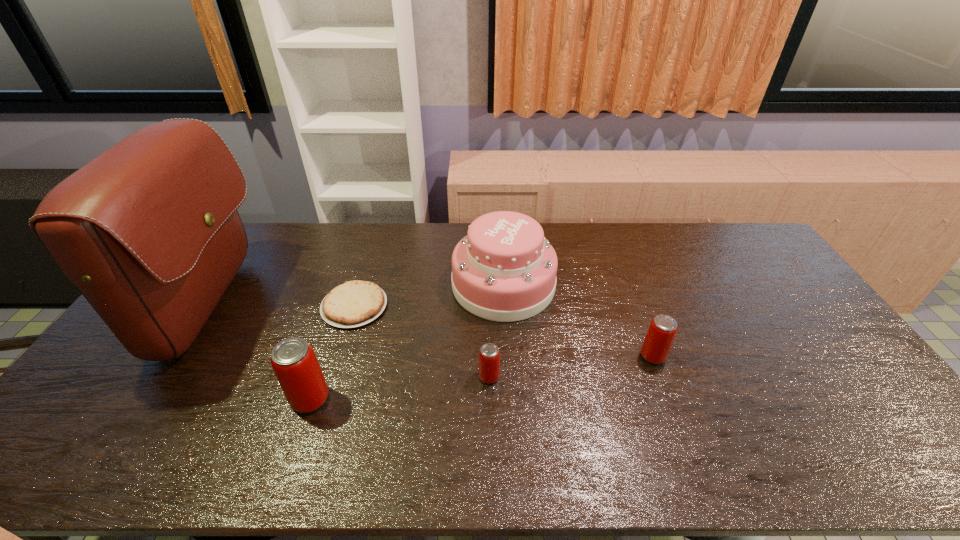
Identify the location of free spot that satisfies the following two spatial constraints: 1. on the back side of the second shortest beer can; 2. on the left side of the fourth shortest object. The width and height of the screenshot is (960, 540). (324, 356).

You are a GUI agent. You are given a task and a screenshot of the screen. Output one action in this format:
    pyautogui.click(x=<x>, y=<y>)
    Task: Click on the vacant space that satisfies the following two spatial constraints: 1. on the open flap of the second tallest beer can; 2. on the left side of the leftmost object
    The height and width of the screenshot is (540, 960).
    Given the screenshot: What is the action you would take?
    pyautogui.click(x=180, y=356)

Find the location of a particular element. free spot that satisfies the following two spatial constraints: 1. on the back side of the tallest beer can; 2. on the open flap of the tallest object is located at coordinates (341, 307).

Image resolution: width=960 pixels, height=540 pixels. I want to click on vacant space that satisfies the following two spatial constraints: 1. on the back side of the second beer can from right to left; 2. on the left side of the second tallest beer can, so click(489, 356).

The width and height of the screenshot is (960, 540). Identify the location of free space that satisfies the following two spatial constraints: 1. on the front side of the tortilla; 2. on the right side of the second beer can from right to left. (333, 376).

The height and width of the screenshot is (540, 960). Find the location of `vacant region that satisfies the following two spatial constraints: 1. on the back side of the second tallest object; 2. on the right side of the third tallest object`. vacant region that satisfies the following two spatial constraints: 1. on the back side of the second tallest object; 2. on the right side of the third tallest object is located at coordinates (348, 285).